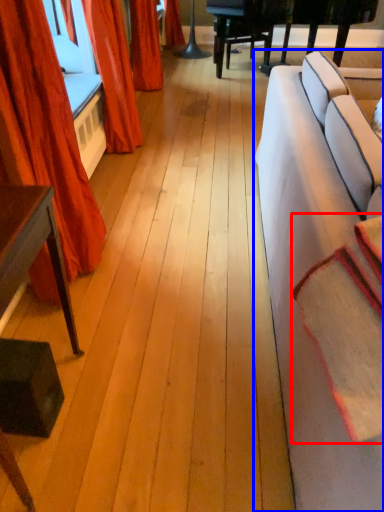
Question: Which of the following is the farthest to the observer, blanket (highlighted by a red box) or studio couch (highlighted by a blue box)?

Choices:
 (A) blanket
 (B) studio couch

Answer: (A)